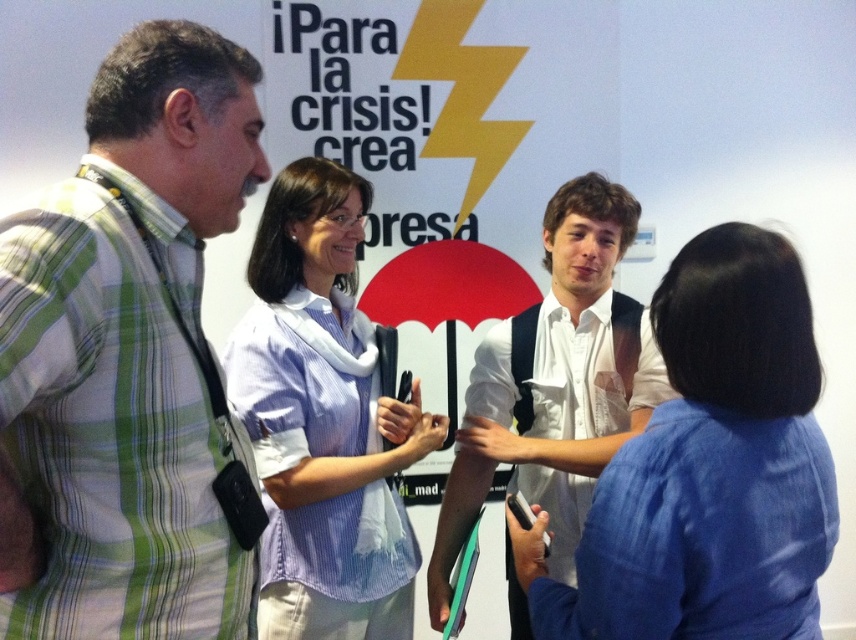
You are organizing a photo shoot and need to arrange two shirts on a mannequin. The light blue striped shirt at center and the white shirt at center. Which shirt should you place first if you want the wider shirt to be on top?

The white shirt at center is wider than the light blue striped shirt at center, so you should place the white shirt at center first on the mannequin to have the wider shirt on top.